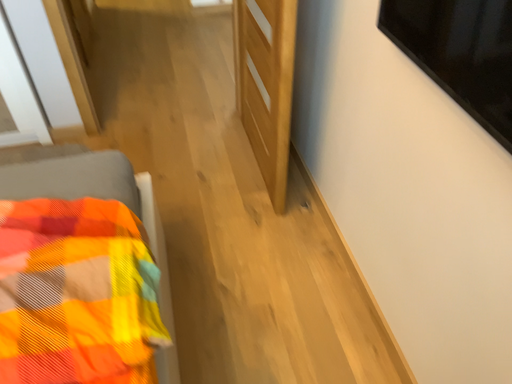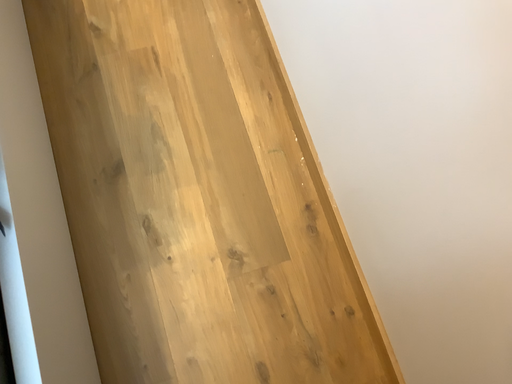
Question: How did the camera likely rotate when shooting the video?

Choices:
 (A) rotated upward
 (B) rotated downward

Answer: (B)